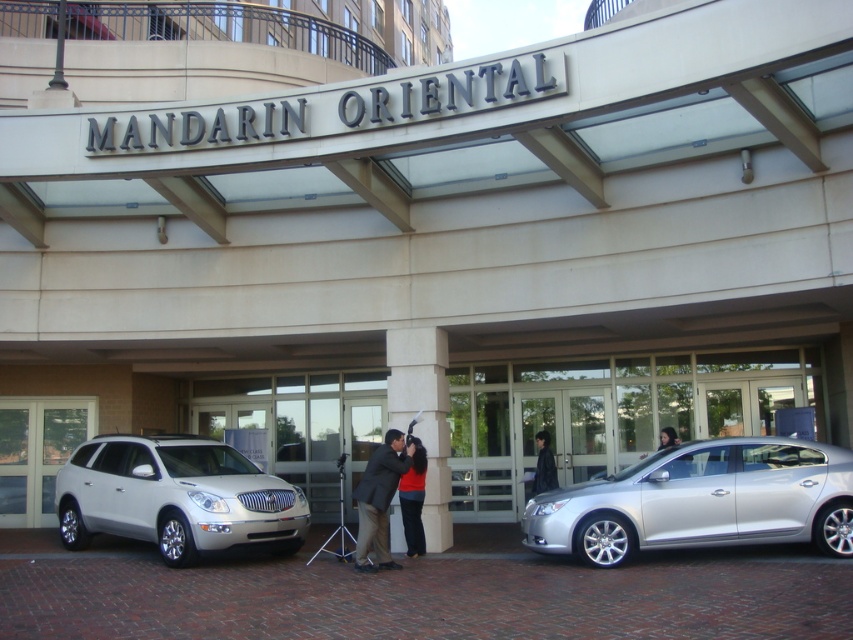
Question: Which of these objects is positioned closest to the silver metallic tripod at center?

Choices:
 (A) matte black suit at center
 (B) silver metallic suv at left
 (C) red matte shirt at center
 (D) black leather jacket at center

Answer: (D)

Question: Where is matte black suit at center located in relation to silver metallic tripod at center in the image?

Choices:
 (A) right
 (B) left

Answer: (A)

Question: Is silver metallic sedan at center in front of red matte shirt at center?

Choices:
 (A) yes
 (B) no

Answer: (A)

Question: Which point is closer to the camera?

Choices:
 (A) (341, 508)
 (B) (413, 504)
 (C) (532, 492)

Answer: (B)

Question: Can you confirm if silver metallic sedan at center is positioned to the left of silver metallic tripod at center?

Choices:
 (A) yes
 (B) no

Answer: (B)

Question: Which object appears closest to the camera in this image?

Choices:
 (A) silver metallic tripod at center
 (B) matte black suit at center
 (C) silver metallic sedan at center

Answer: (C)